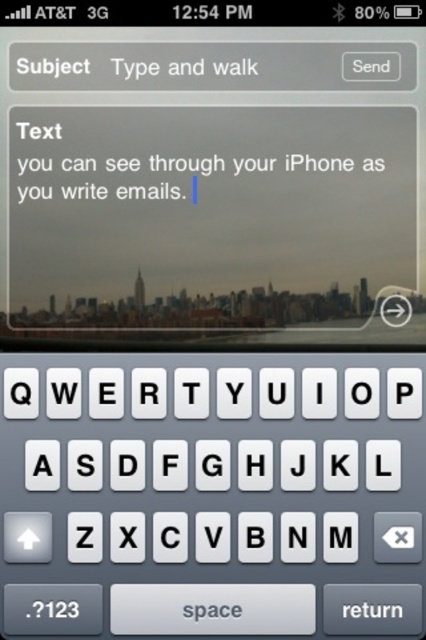
Question: Which object is closer to the camera taking this photo?

Choices:
 (A) white plastic keyboard at bottom
 (B) transparent plastic text at center
 (C) transparent glass text field at center

Answer: (A)

Question: Which point is closer to the camera taking this photo?

Choices:
 (A) (135, 259)
 (B) (356, 140)

Answer: (B)

Question: Is transparent glass text field at center to the left of transparent plastic text at center from the viewer's perspective?

Choices:
 (A) yes
 (B) no

Answer: (B)

Question: Where is transparent glass text field at center located in relation to transparent plastic text at center in the image?

Choices:
 (A) left
 (B) right

Answer: (B)

Question: Which point is closer to the camera taking this photo?

Choices:
 (A) (230, 465)
 (B) (325, 259)

Answer: (A)

Question: Considering the relative positions of white plastic keyboard at bottom and transparent plastic text at center in the image provided, where is white plastic keyboard at bottom located with respect to transparent plastic text at center?

Choices:
 (A) below
 (B) above

Answer: (A)